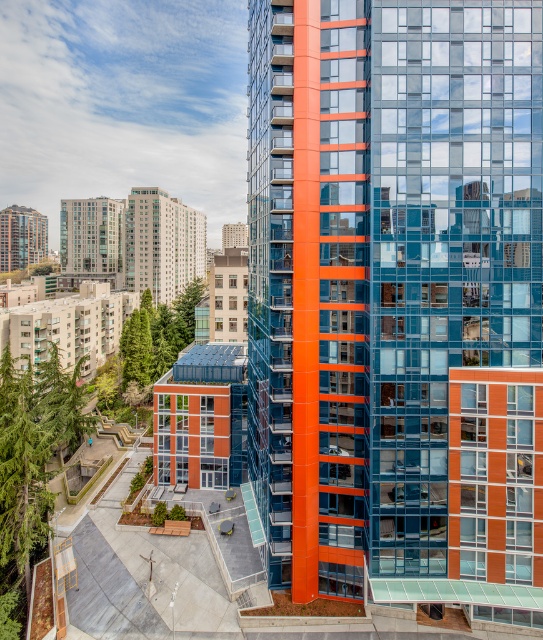
Question: Can you confirm if orange glass building at center is thinner than matte glass building at upper left?

Choices:
 (A) yes
 (B) no

Answer: (A)

Question: Which point is closer to the camera?

Choices:
 (A) (476, 196)
 (B) (45, 221)
 (C) (75, 269)

Answer: (A)

Question: Which point is closer to the camera taking this photo?

Choices:
 (A) (18, 246)
 (B) (318, 512)
 (C) (124, 276)

Answer: (B)

Question: Can you confirm if matte glass building at center is thinner than matte glass building at upper left?

Choices:
 (A) no
 (B) yes

Answer: (B)

Question: Is matte glass building at center positioned in front of matte glass building at upper left?

Choices:
 (A) yes
 (B) no

Answer: (B)

Question: Which point is farther from the camera taking this photo?

Choices:
 (A) (121, 250)
 (B) (483, 564)

Answer: (A)